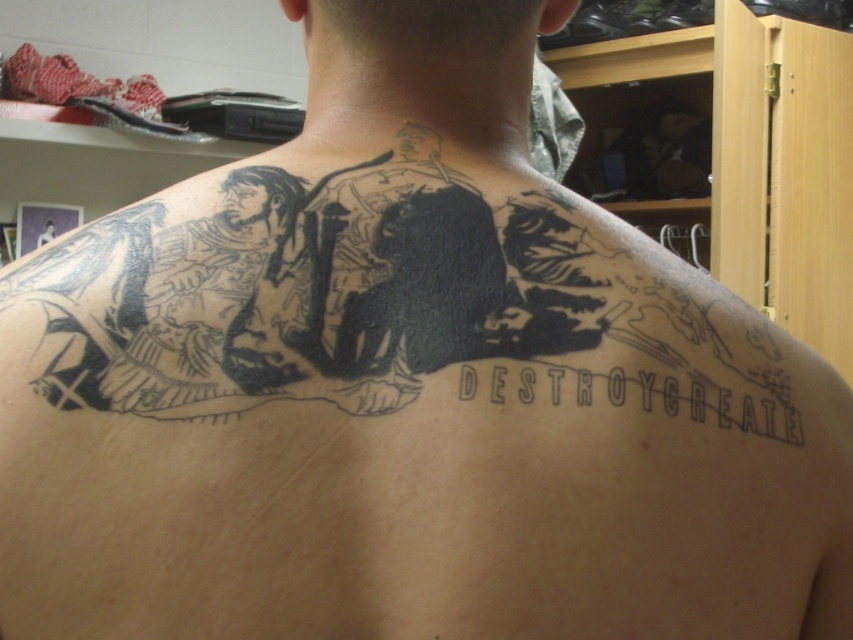
Question: Can you confirm if black ink tattoo at upper center is positioned above black ink text at lower center?

Choices:
 (A) yes
 (B) no

Answer: (A)

Question: Can you confirm if black ink tattoo at upper center is bigger than black ink text at lower center?

Choices:
 (A) no
 (B) yes

Answer: (B)

Question: Does black ink tattoo at upper center have a lesser width compared to black ink text at lower center?

Choices:
 (A) yes
 (B) no

Answer: (B)